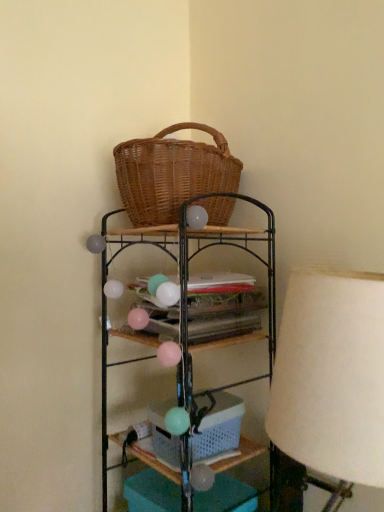
Question: From a real-world perspective, is matte wicker basket at center located higher than white fabric lampshade at right?

Choices:
 (A) no
 (B) yes

Answer: (A)

Question: Does matte wicker basket at center turn towards white fabric lampshade at right?

Choices:
 (A) no
 (B) yes

Answer: (A)

Question: Considering the relative positions of matte wicker basket at center and white fabric lampshade at right in the image provided, is matte wicker basket at center behind white fabric lampshade at right?

Choices:
 (A) no
 (B) yes

Answer: (B)

Question: Can you confirm if matte wicker basket at center is smaller than white fabric lampshade at right?

Choices:
 (A) yes
 (B) no

Answer: (A)

Question: Is matte wicker basket at center surrounding white fabric lampshade at right?

Choices:
 (A) yes
 (B) no

Answer: (B)

Question: From their relative heights in the image, would you say white fabric lampshade at right is taller or shorter than woven wood basket at upper center?

Choices:
 (A) short
 (B) tall

Answer: (A)

Question: Relative to woven wood basket at upper center, is white fabric lampshade at right in front or behind?

Choices:
 (A) front
 (B) behind

Answer: (A)

Question: From the image's perspective, relative to woven wood basket at upper center, is white fabric lampshade at right above or below?

Choices:
 (A) below
 (B) above

Answer: (B)

Question: Is white fabric lampshade at right situated inside woven wood basket at upper center or outside?

Choices:
 (A) outside
 (B) inside

Answer: (A)

Question: Which is correct: white fabric lampshade at right is inside woven brown picnic basket at upper center, or outside of it?

Choices:
 (A) inside
 (B) outside

Answer: (B)

Question: Considering the positions of white fabric lampshade at right and woven brown picnic basket at upper center in the image, is white fabric lampshade at right wider or thinner than woven brown picnic basket at upper center?

Choices:
 (A) wide
 (B) thin

Answer: (B)

Question: Looking at the image, does white fabric lampshade at right seem bigger or smaller compared to woven brown picnic basket at upper center?

Choices:
 (A) big
 (B) small

Answer: (A)

Question: From a real-world perspective, is white fabric lampshade at right physically located above or below woven brown picnic basket at upper center?

Choices:
 (A) above
 (B) below

Answer: (B)

Question: Is matte wicker basket at center taller or shorter than white fabric lampshade at right?

Choices:
 (A) tall
 (B) short

Answer: (B)

Question: Is matte wicker basket at center to the left or to the right of white fabric lampshade at right in the image?

Choices:
 (A) right
 (B) left

Answer: (B)